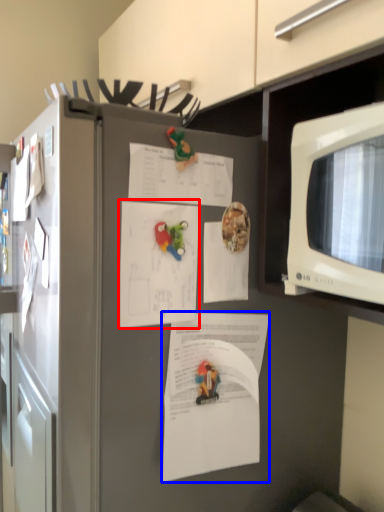
Question: Which point is closer to the camera, document (highlighted by a red box) or document (highlighted by a blue box)?

Choices:
 (A) document
 (B) document

Answer: (B)